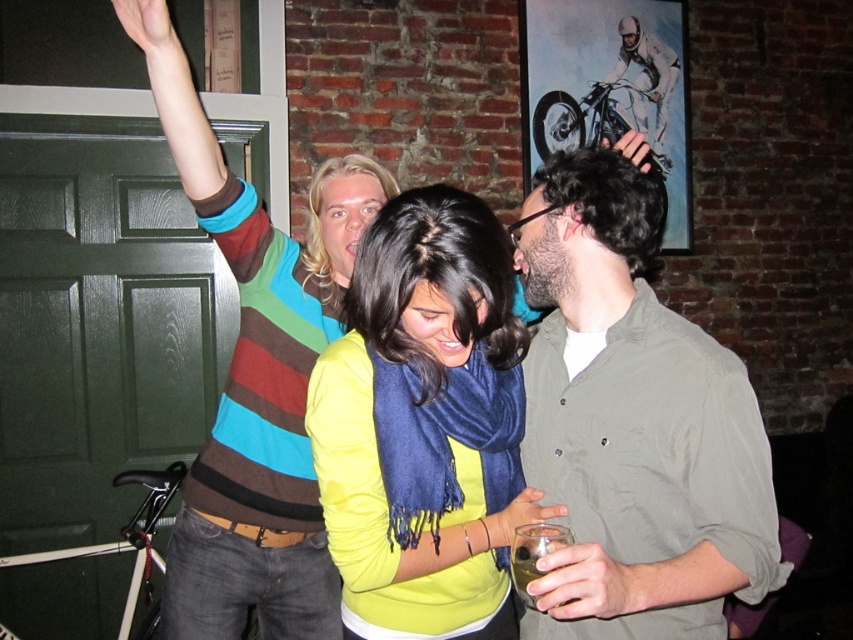
Question: Which object is positioned farthest from the matte green shirt at center?

Choices:
 (A) yellow matte sweater at center
 (B) translucent glass at lower center

Answer: (B)

Question: Which of the following is the farthest from the observer?

Choices:
 (A) (351, 552)
 (B) (691, 564)
 (C) (521, 538)

Answer: (A)

Question: Is matte green shirt at center closer to the viewer compared to translucent glass at lower center?

Choices:
 (A) yes
 (B) no

Answer: (A)

Question: Observing the image, what is the correct spatial positioning of matte green shirt at center in reference to yellow matte sweater at center?

Choices:
 (A) above
 (B) below

Answer: (A)

Question: From the image, what is the correct spatial relationship of matte green shirt at center in relation to translucent glass at lower center?

Choices:
 (A) above
 (B) below

Answer: (A)

Question: Among these objects, which one is farthest from the camera?

Choices:
 (A) translucent glass at lower center
 (B) yellow matte sweater at center

Answer: (B)